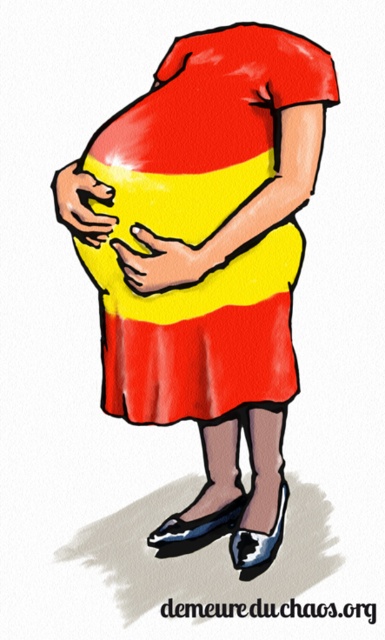
You are an assistant helping someone choose an outfit. The person wants to wear a dress that is on the left side of the image. Which dress should they choose between the matte red dress at center and the yellow matte dress at center?

The yellow matte dress at center is on the left side, so they should choose the yellow matte dress at center.

From the picture: You are an artist trying to draw the same image. You want to place the matte red dress at center exactly where it was in the original image. What coordinates should you use for its position?

The matte red dress at center should be placed at coordinates point (214, 262).

You are an artist trying to draw the scene described. You want to ensure the proportions are correct. Which object should you draw first, the yellow matte dress at center or the yellow matte hand at center, and why?

You should draw the yellow matte dress at center first because it has a larger size compared to the yellow matte hand at center, making it the main focus for establishing proportions.